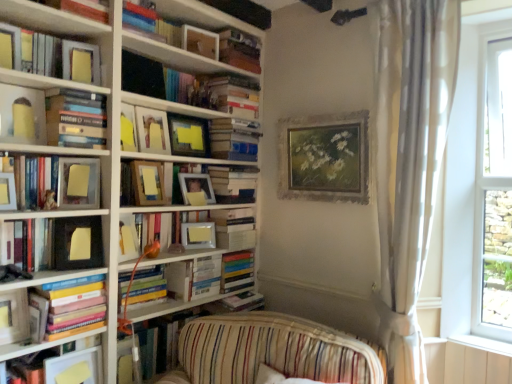
Question: Looking at the image, does wooden picture frame at center, which is counted as the seventh picture frame, starting from the right, seem bigger or smaller compared to matte black picture frame at upper left, which is the 9th picture frame from right to left?

Choices:
 (A) small
 (B) big

Answer: (B)

Question: In terms of width, does wooden picture frame at center, which is counted as the seventh picture frame, starting from the right, look wider or thinner when compared to matte black picture frame at upper left, positioned as the second picture frame in left-to-right order?

Choices:
 (A) thin
 (B) wide

Answer: (B)

Question: Which object is the closest to the hardcover book at upper center, which is the 14th book in bottom-to-top order?

Choices:
 (A) matte black picture frame at upper left, positioned as the second picture frame in left-to-right order
 (B) matte wooden shelf at center, placed as the 1th shelf when sorted from bottom to top
 (C) silver metallic picture frame at center, marked as the eighth picture frame in a left-to-right arrangement
 (D) wooden picture frame at upper center, acting as the 9th picture frame starting from the left
 (E) wooden picture frame at center, which is counted as the 4th picture frame, starting from the left

Answer: (D)

Question: Which object is the closest to the matte silver picture frame at left, positioned as the 1th picture frame in left-to-right order?

Choices:
 (A) wooden book at upper center, the fourth book when ordered from top to bottom
 (B) matte black frame at left, acting as the thirteenth book starting from the top
 (C) white sheer curtain at right
 (D) silver metallic picture frame at center, marked as the eighth picture frame in a left-to-right arrangement
 (E) matte yellow paper at upper center, the 5th picture frame viewed from the right

Answer: (B)